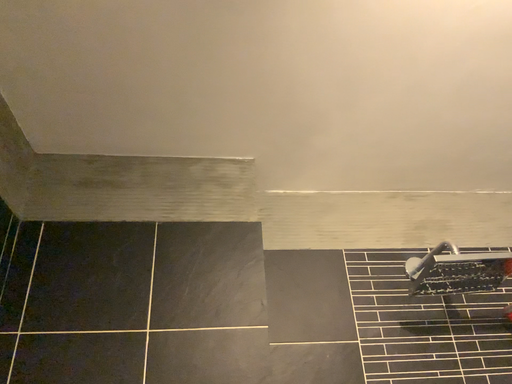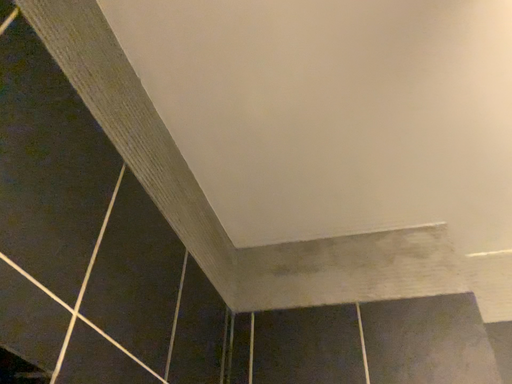
Question: Which way did the camera rotate in the video?

Choices:
 (A) rotated right
 (B) rotated left

Answer: (B)